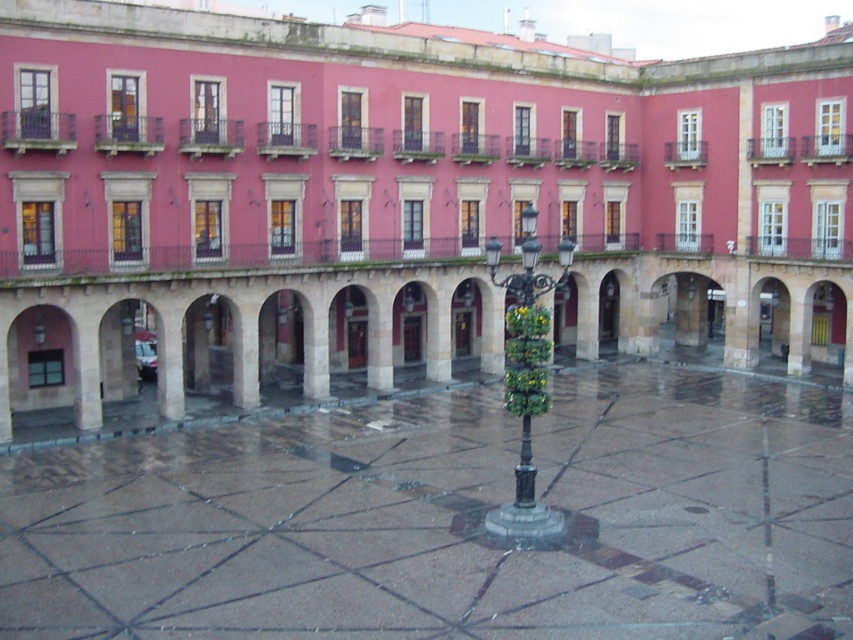
Question: From the image, what is the correct spatial relationship of polished stone courtyard at center in relation to black metal streetlamp at center?

Choices:
 (A) left
 (B) right

Answer: (A)

Question: Does polished stone courtyard at center come in front of black metal streetlamp at center?

Choices:
 (A) yes
 (B) no

Answer: (A)

Question: Among these points, which one is nearest to the camera?

Choices:
 (A) (531, 544)
 (B) (488, 241)

Answer: (A)

Question: From the image, what is the correct spatial relationship of polished stone courtyard at center in relation to black metal streetlamp at center?

Choices:
 (A) right
 (B) left

Answer: (B)